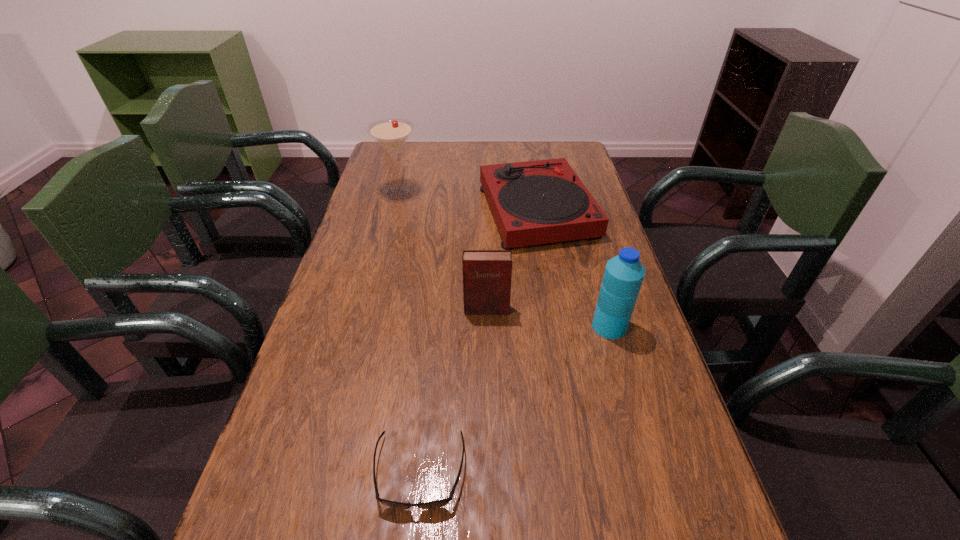
Identify the location of empty location between the sunglasses and the third shortest object. (453, 390).

Locate an element on the screen. free space between the diary and the leftmost object is located at coordinates point(443,251).

Image resolution: width=960 pixels, height=540 pixels. What are the coordinates of `free spot between the fourth tallest object and the water bottle` in the screenshot? It's located at tap(573, 269).

Image resolution: width=960 pixels, height=540 pixels. What are the coordinates of `empty space that is in between the water bottle and the record player` in the screenshot? It's located at (573, 269).

You are a GUI agent. You are given a task and a screenshot of the screen. Output one action in this format:
    pyautogui.click(x=<x>, y=<y>)
    Task: Click on the vacant area that lies between the third shortest object and the water bottle
    The height and width of the screenshot is (540, 960).
    Given the screenshot: What is the action you would take?
    pyautogui.click(x=548, y=318)

This screenshot has height=540, width=960. Identify the location of free area in between the sunglasses and the water bottle. (515, 399).

At what (x,y) coordinates should I click in order to perform the action: click on object that is the fourth nearest to the record player. Please return your answer as a coordinate pair (x, y). The height and width of the screenshot is (540, 960). Looking at the image, I should click on (438, 503).

Point out which object is positioned as the second nearest to the third tallest object. Please provide its 2D coordinates. Your answer should be formatted as a tuple, i.e. [(x, y)], where the tuple contains the x and y coordinates of a point satisfying the conditions above.

[(536, 202)]

Find the location of a particular element. The image size is (960, 540). vacant point that satisfies the following two spatial constraints: 1. on the front cover of the diary; 2. on the right side of the water bottle is located at coordinates (487, 326).

Where is `free space that satisfies the following two spatial constraints: 1. on the front cover of the water bottle; 2. on the left side of the diary`? The image size is (960, 540). free space that satisfies the following two spatial constraints: 1. on the front cover of the water bottle; 2. on the left side of the diary is located at coordinates (487, 326).